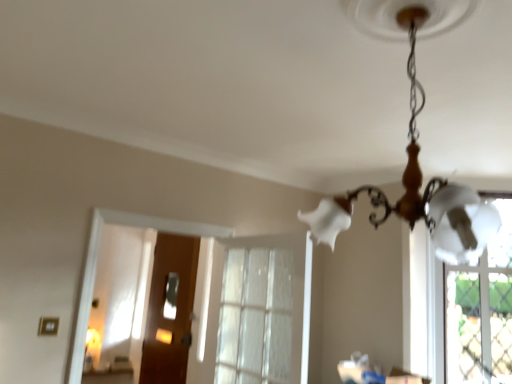
Question: Considering the relative sizes of wooden door at center and clear glass window at center in the image provided, is wooden door at center taller than clear glass window at center?

Choices:
 (A) no
 (B) yes

Answer: (B)

Question: Is wooden door at center to the left of clear glass window at center from the viewer's perspective?

Choices:
 (A) yes
 (B) no

Answer: (A)

Question: From a real-world perspective, is wooden door at center on top of clear glass window at center?

Choices:
 (A) no
 (B) yes

Answer: (A)

Question: Does wooden door at center come behind clear glass window at center?

Choices:
 (A) no
 (B) yes

Answer: (B)

Question: Can you confirm if wooden door at center is positioned to the right of clear glass window at center?

Choices:
 (A) no
 (B) yes

Answer: (A)

Question: Is point (453, 211) positioned closer to the camera than point (232, 289)?

Choices:
 (A) closer
 (B) farther

Answer: (A)

Question: Based on their positions, is white glass chandelier at upper center located to the left or right of clear glass window at center?

Choices:
 (A) left
 (B) right

Answer: (B)

Question: From the image's perspective, is white glass chandelier at upper center above or below clear glass window at center?

Choices:
 (A) above
 (B) below

Answer: (A)

Question: From a real-world perspective, is white glass chandelier at upper center above or below clear glass window at center?

Choices:
 (A) above
 (B) below

Answer: (A)

Question: Looking at their shapes, would you say wooden door at center is wider or thinner than clear glass window at center?

Choices:
 (A) wide
 (B) thin

Answer: (B)

Question: Based on their sizes in the image, would you say wooden door at center is bigger or smaller than clear glass window at center?

Choices:
 (A) big
 (B) small

Answer: (B)

Question: Do you think wooden door at center is within clear glass window at center, or outside of it?

Choices:
 (A) outside
 (B) inside

Answer: (A)

Question: From a real-world perspective, is wooden door at center above or below clear glass window at center?

Choices:
 (A) below
 (B) above

Answer: (A)

Question: Considering the positions of clear glass window at center and wooden door at center in the image, is clear glass window at center bigger or smaller than wooden door at center?

Choices:
 (A) small
 (B) big

Answer: (B)

Question: From a real-world perspective, is clear glass window at center above or below wooden door at center?

Choices:
 (A) below
 (B) above

Answer: (B)